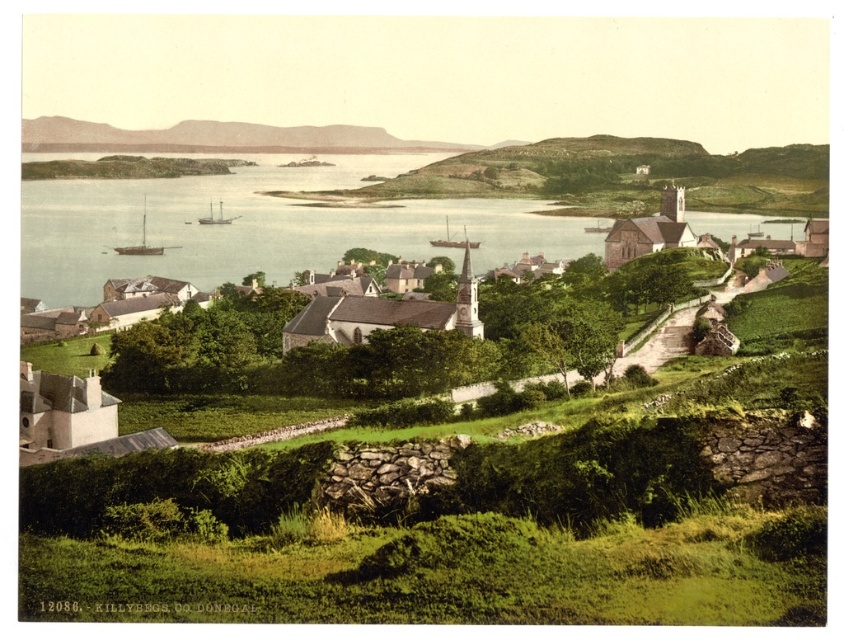
You are standing in the coastal village of Killybegs and want to take a photo of the rustic stone wall at upper center and the wooden sailboat at center. Which object should you focus on first to ensure both are in the frame?

You should focus on the rustic stone wall at upper center first because it is closer to you than the wooden sailboat at center. By focusing on the closer object, both will be in focus due to the depth of field.